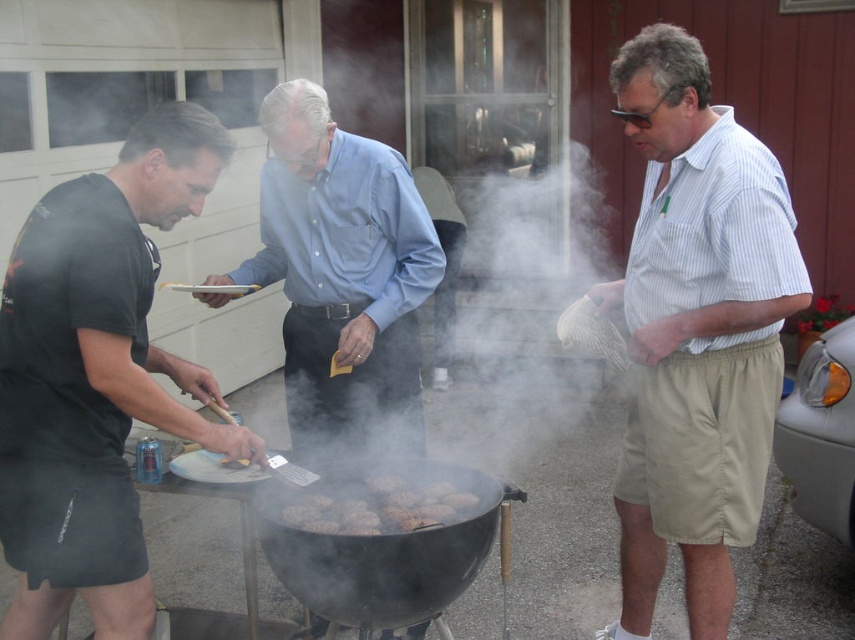
Does blue cotton shirt at center have a lesser height compared to black matte barbecue grill at center?

No.

Does blue cotton shirt at center have a larger size compared to black matte barbecue grill at center?

Correct, blue cotton shirt at center is larger in size than black matte barbecue grill at center.

Who is more forward, (414, 268) or (357, 548)?

Point (357, 548) is more forward.

This screenshot has width=855, height=640. I want to click on blue cotton shirt at center, so click(342, 268).

Is black matte t-shirt at left shorter than blue cotton shirt at center?

→ No, black matte t-shirt at left is not shorter than blue cotton shirt at center.

Is point (124, 432) positioned before point (333, 259)?

That is True.

At what (x,y) coordinates should I click in order to perform the action: click on black matte t-shirt at left. Please return your answer as a coordinate pair (x, y). This screenshot has width=855, height=640. Looking at the image, I should click on (96, 376).

Does point (91, 204) lie behind point (414, 488)?

That is False.

Which is above, black matte t-shirt at left or brown crispy burger patties at center?

Positioned higher is black matte t-shirt at left.

Who is more forward, (127, 205) or (311, 525)?

Point (127, 205) is more forward.

The width and height of the screenshot is (855, 640). What are the coordinates of `black matte t-shirt at left` in the screenshot? It's located at (96, 376).